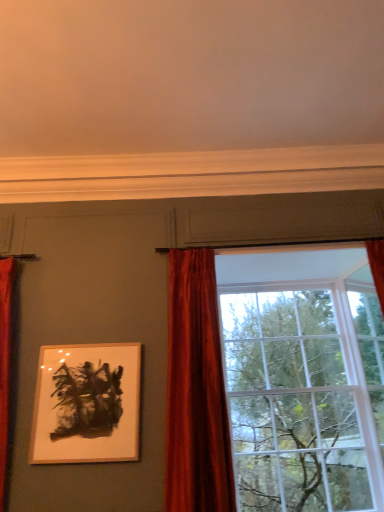
Question: Is point (190, 474) closer or farther from the camera than point (56, 373)?

Choices:
 (A) closer
 (B) farther

Answer: (A)

Question: Considering the positions of velvet red curtain at center and wooden picture frame at upper left in the image, is velvet red curtain at center taller or shorter than wooden picture frame at upper left?

Choices:
 (A) tall
 (B) short

Answer: (A)

Question: Which is farther from the velvet red curtain at center?

Choices:
 (A) glass window at center
 (B) wooden picture frame at upper left

Answer: (B)

Question: Which object is positioned farthest from the velvet red curtain at center?

Choices:
 (A) glass window at center
 (B) wooden picture frame at upper left

Answer: (B)